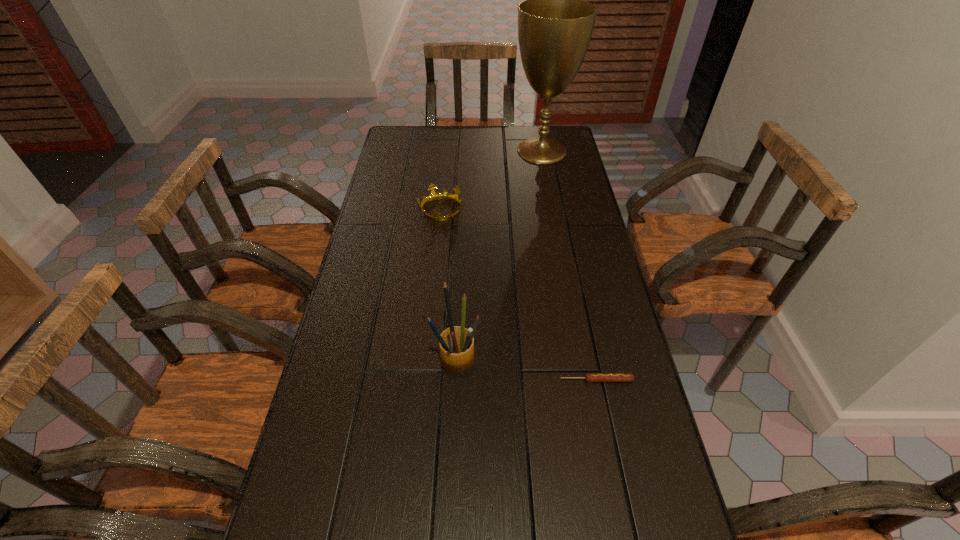
Locate an element on the screen. the farthest object is located at coordinates (555, 24).

Locate an element on the screen. Image resolution: width=960 pixels, height=540 pixels. the tallest object is located at coordinates (555, 24).

You are a GUI agent. You are given a task and a screenshot of the screen. Output one action in this format:
    pyautogui.click(x=<x>, y=<y>)
    Task: Click on the pencil box
    
    Given the screenshot: What is the action you would take?
    pyautogui.click(x=456, y=344)

This screenshot has height=540, width=960. I want to click on the third tallest object, so click(433, 196).

Where is `crown`? The width and height of the screenshot is (960, 540). crown is located at coordinates (433, 196).

Find the location of a particular element. the shortest object is located at coordinates (589, 377).

Identify the location of blank space located on the front of the tallest object. (547, 178).

This screenshot has width=960, height=540. Identify the location of vacant space located 0.050m on the left of the pencil box. (415, 359).

I want to click on vacant space located 0.380m on the back of the crown, so click(x=447, y=144).

Find the location of `vacant region located on the front of the sausage`. vacant region located on the front of the sausage is located at coordinates (607, 431).